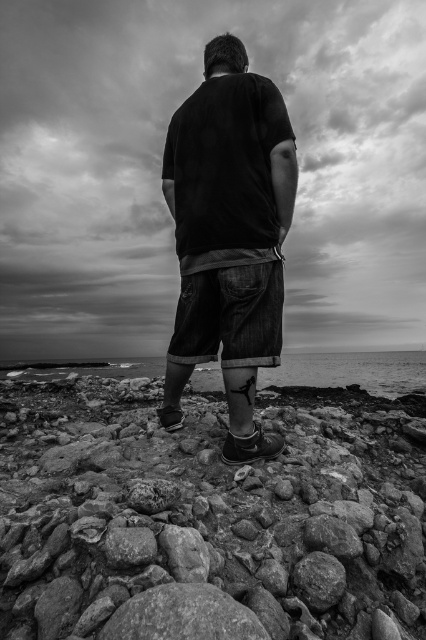
Question: Which of the following is the farthest from the observer?

Choices:
 (A) denim shorts at center
 (B) smooth water at lower center

Answer: (B)

Question: Among these points, which one is nearest to the camera?

Choices:
 (A) (400, 371)
 (B) (65, 440)

Answer: (B)

Question: Based on their relative distances, which object is farther from the denim shorts at center?

Choices:
 (A) smooth rock at center
 (B) smooth water at lower center

Answer: (B)

Question: Does smooth rock at center have a smaller size compared to denim shorts at center?

Choices:
 (A) no
 (B) yes

Answer: (A)

Question: From the image, what is the correct spatial relationship of denim shorts at center in relation to smooth water at lower center?

Choices:
 (A) left
 (B) right

Answer: (A)

Question: Is smooth rock at center wider than smooth water at lower center?

Choices:
 (A) no
 (B) yes

Answer: (A)